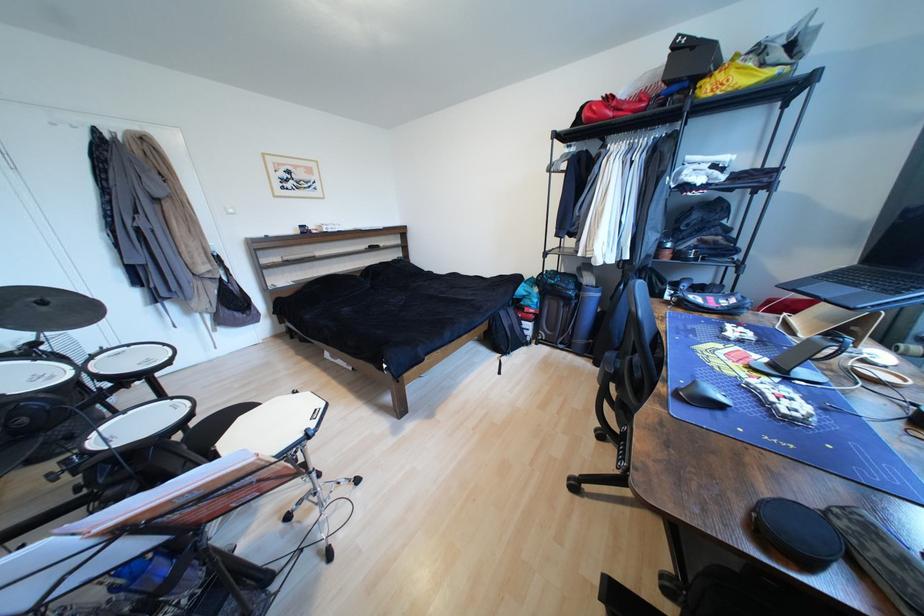
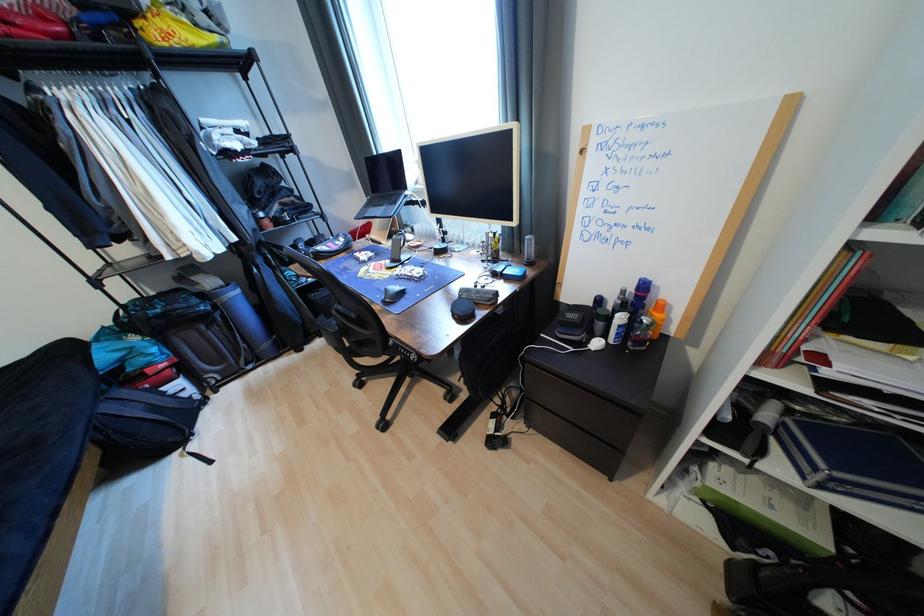
Locate, in the second image, the point that corresponds to [508,315] in the first image.

(116, 408)